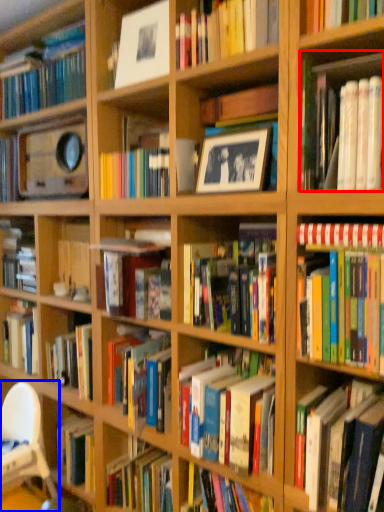
Question: Among these objects, which one is nearest to the camera, book (highlighted by a red box) or chair (highlighted by a blue box)?

Choices:
 (A) book
 (B) chair

Answer: (A)